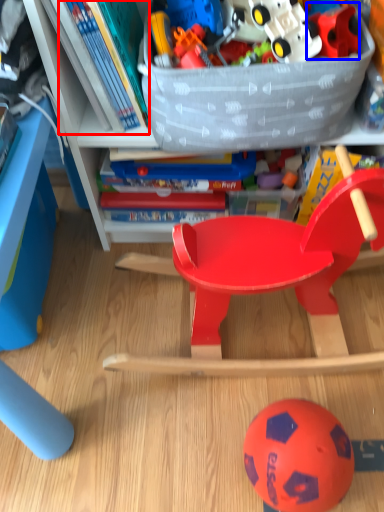
Question: Among these objects, which one is farthest to the camera, book (highlighted by a red box) or toy (highlighted by a blue box)?

Choices:
 (A) book
 (B) toy

Answer: (B)